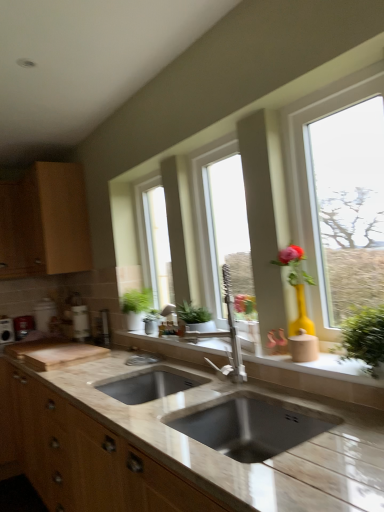
Question: From the image's perspective, is wooden cabinet at left located above or below green leafy plant at right, positioned as the 2th houseplant in left-to-right order?

Choices:
 (A) below
 (B) above

Answer: (B)

Question: Would you say wooden cabinet at left is to the left or to the right of green leafy plant at right, positioned as the 2th houseplant in left-to-right order, in the picture?

Choices:
 (A) right
 (B) left

Answer: (B)

Question: Based on their relative distances, which object is farther from the green matte plant at center, acting as the 1th houseplant starting from the left?

Choices:
 (A) yellow matte vase at right, the third window viewed from the left
 (B) green leafy plant at right, placed as the first houseplant when sorted from front to back
 (C) green matte plant at center, marked as the 3th window in a front-to-back arrangement
 (D) brushed metal toaster at lower left, placed as the 1th appliance when sorted from left to right
 (E) wooden cabinet at left

Answer: (B)

Question: Estimate the real-world distances between objects in this image. Which object is closer to the metallic silver toaster at left, which is counted as the 1th appliance, starting from the right?

Choices:
 (A) wooden cabinet at left
 (B) green leafy plant at right, the 2th houseplant positioned from the back
 (C) beige stone sink at center
 (D) clear glass window at center, which ranks as the second window in left-to-right order
 (E) green matte plant at center, marked as the 3th window in a front-to-back arrangement

Answer: (A)